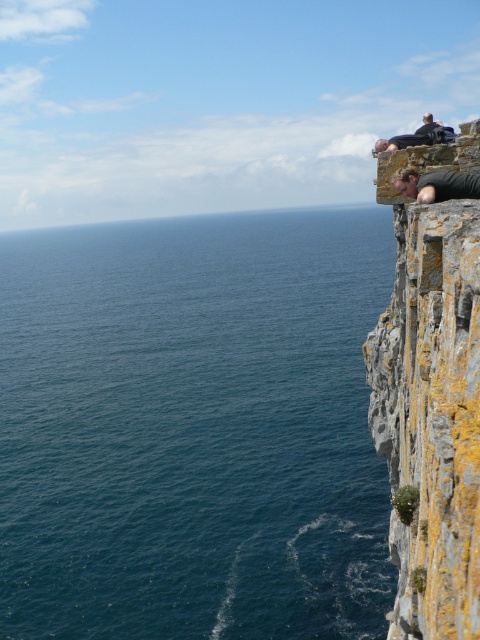
Measure the distance between point (29, 449) and camera.

68.33 meters

Is blue water at left taller than yellow mossy rock at upper right?

Yes, blue water at left is taller than yellow mossy rock at upper right.

Between point (194, 561) and point (372, 376), which one is positioned behind?

Point (194, 561)

In order to click on blue water at left in this screenshot , I will do 192,428.

Does point (156, 534) lie in front of point (424, 128)?

No.

The width and height of the screenshot is (480, 640). Describe the element at coordinates (192, 428) in the screenshot. I see `blue water at left` at that location.

Which is in front, point (110, 556) or point (428, 113)?

Point (110, 556)

At what (x,y) coordinates should I click in order to perform the action: click on blue water at left. Please return your answer as a coordinate pair (x, y). Looking at the image, I should click on (x=192, y=428).

Is blue water at left taller than dark gray stone climber at upper right?

Correct, blue water at left is much taller as dark gray stone climber at upper right.

This screenshot has width=480, height=640. Describe the element at coordinates (192, 428) in the screenshot. I see `blue water at left` at that location.

The image size is (480, 640). What do you see at coordinates (192, 428) in the screenshot?
I see `blue water at left` at bounding box center [192, 428].

This screenshot has height=640, width=480. Find the location of `blue water at left`. blue water at left is located at coordinates (192, 428).